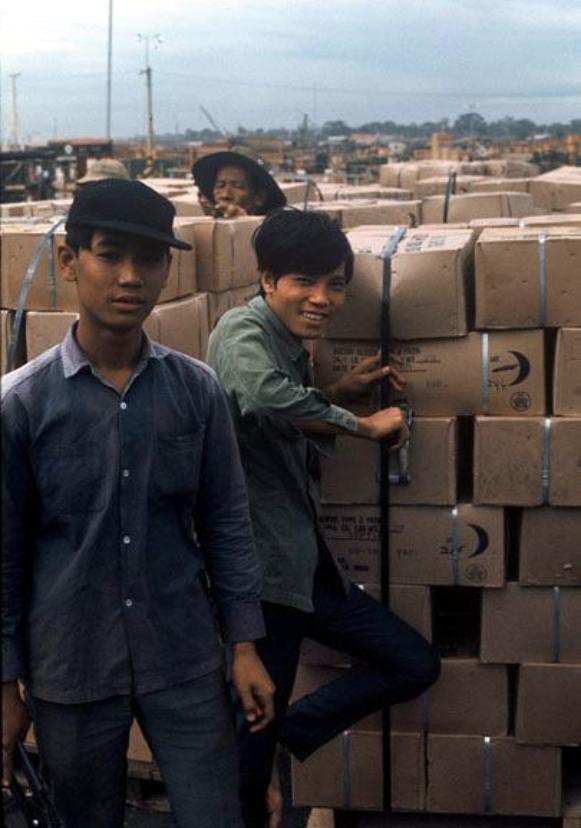
The height and width of the screenshot is (828, 581). In order to click on stacks of boxes in this screenshot , I will do `click(474, 686)`.